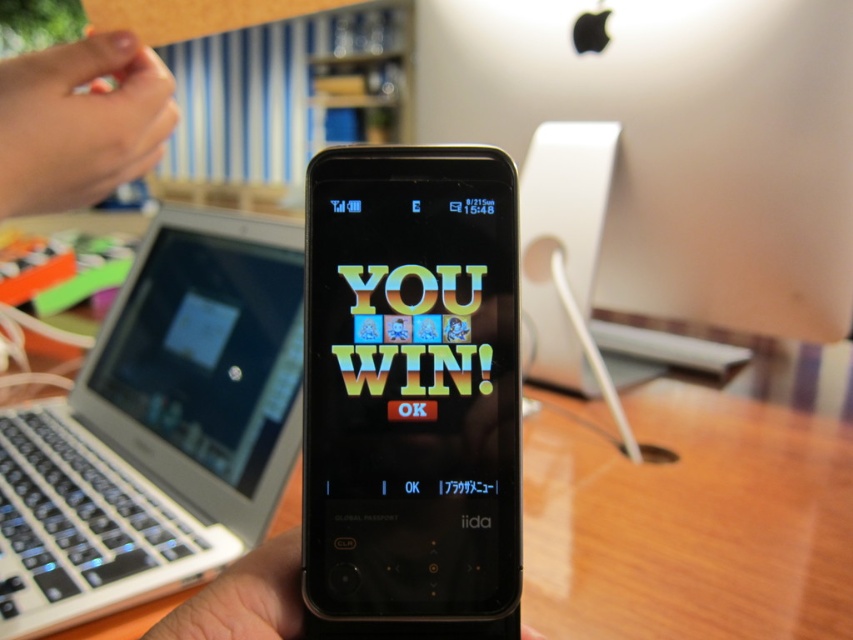
Question: Is black glossy smartphone at center positioned behind black matte phone at center?

Choices:
 (A) no
 (B) yes

Answer: (B)

Question: Which of the following is the closest to the observer?

Choices:
 (A) (202, 625)
 (B) (132, 44)
 (C) (178, 275)

Answer: (A)

Question: Considering the real-world distances, which object is farthest from the black glossy smartphone at center?

Choices:
 (A) pink matte fingernail at upper left
 (B) black matte phone at center
 (C) white plastic laptop at left
 (D) matte black laptop at left

Answer: (D)

Question: Which object appears farthest from the camera in this image?

Choices:
 (A) black matte phone at center
 (B) pink matte fingernail at upper left

Answer: (B)

Question: Is black glossy smartphone at center to the left of white plastic laptop at left from the viewer's perspective?

Choices:
 (A) yes
 (B) no

Answer: (B)

Question: Is white plastic laptop at left smaller than black matte phone at center?

Choices:
 (A) yes
 (B) no

Answer: (B)